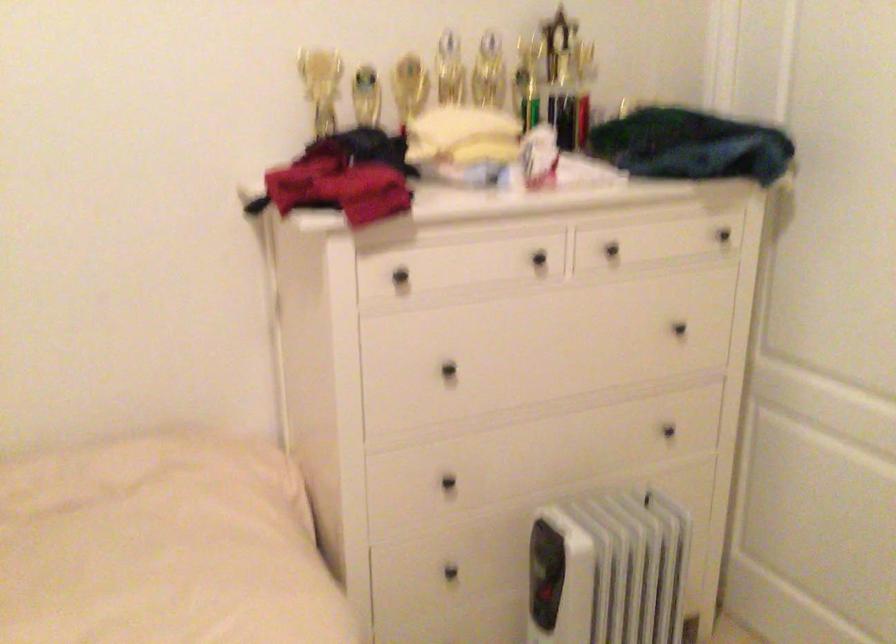
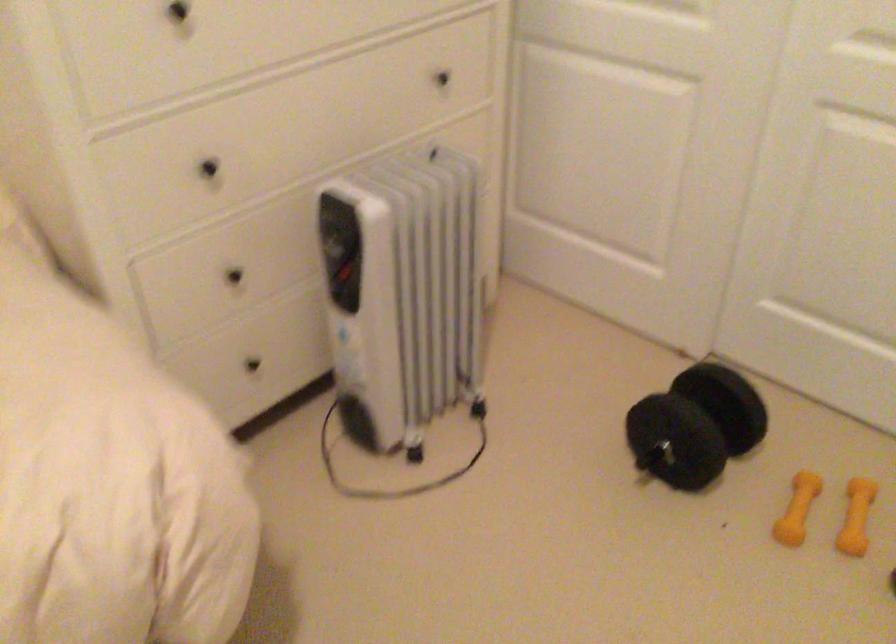
Find the pixel in the second image that matches point 670,431 in the first image.

(442, 79)